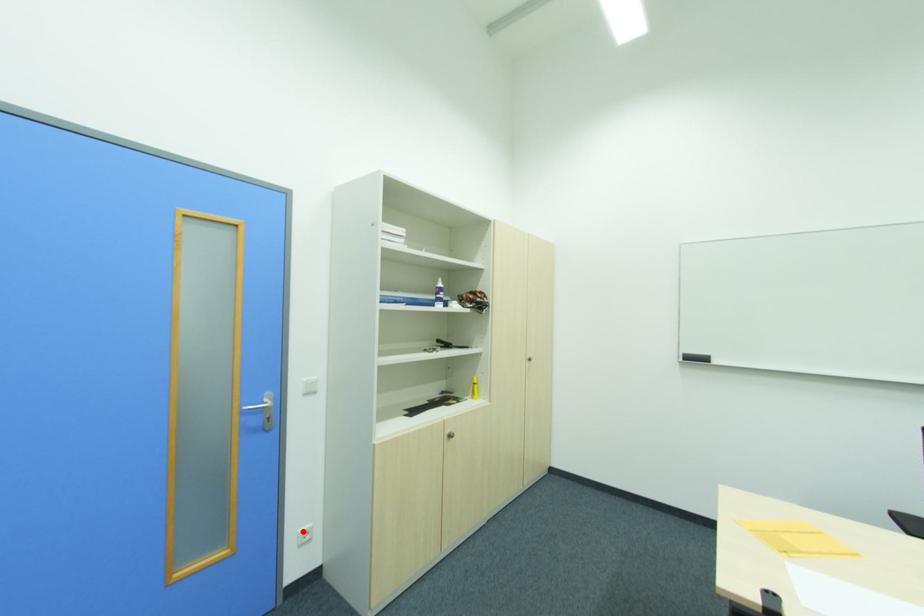
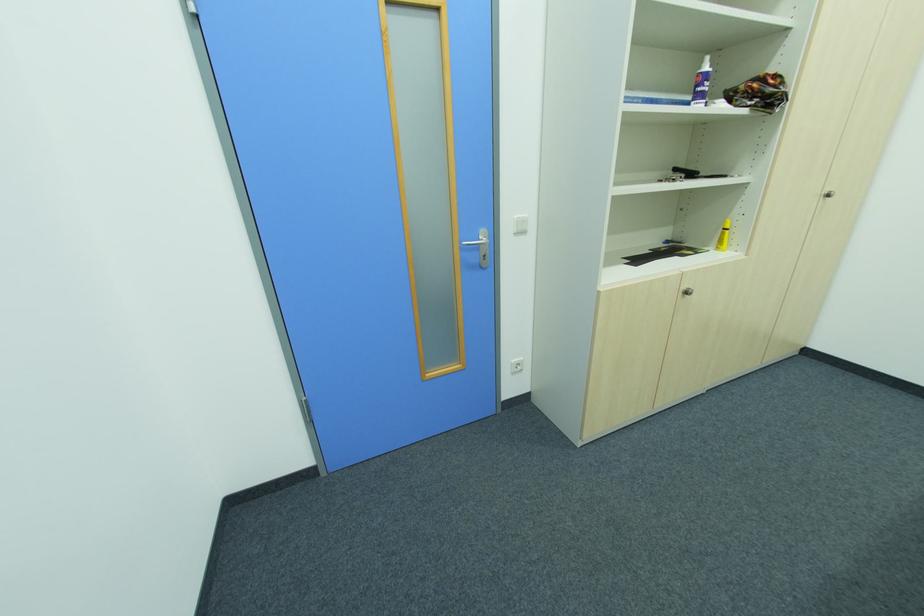
Locate, in the second image, the point that corresponds to the highlighted location in the first image.

(516, 362)